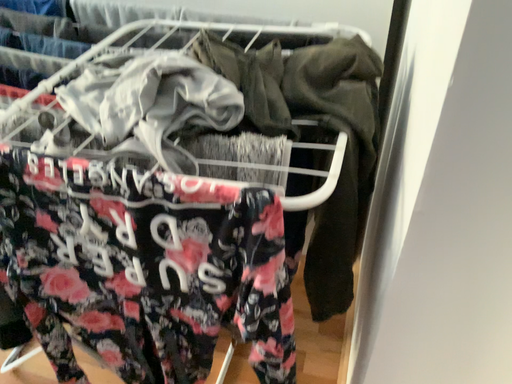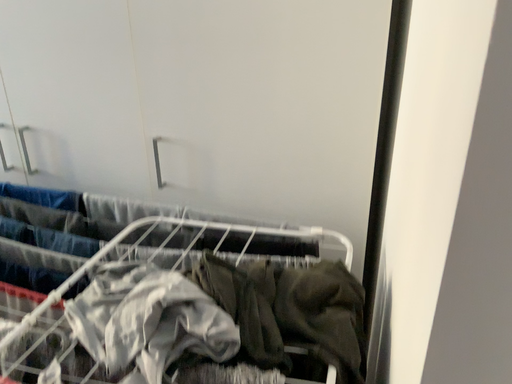
Question: Which way did the camera rotate in the video?

Choices:
 (A) rotated upward
 (B) rotated downward

Answer: (A)